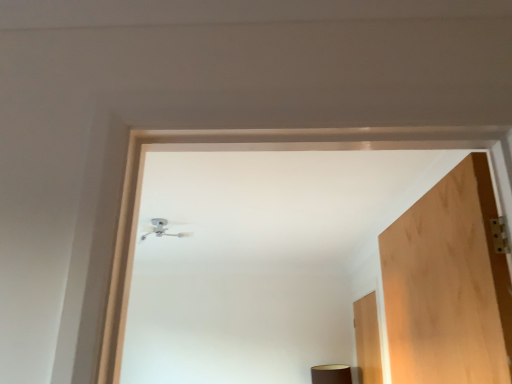
Question: Do you think wooden door at right is within white metallic ceiling light at upper center, or outside of it?

Choices:
 (A) outside
 (B) inside

Answer: (A)

Question: Considering the positions of wooden door at right and white metallic ceiling light at upper center in the image, is wooden door at right wider or thinner than white metallic ceiling light at upper center?

Choices:
 (A) wide
 (B) thin

Answer: (B)

Question: Based on their sizes in the image, would you say wooden door at right is bigger or smaller than white metallic ceiling light at upper center?

Choices:
 (A) big
 (B) small

Answer: (A)

Question: Based on their sizes in the image, would you say white metallic ceiling light at upper center is bigger or smaller than wooden door at right?

Choices:
 (A) small
 (B) big

Answer: (A)

Question: Is white metallic ceiling light at upper center inside the boundaries of wooden door at right, or outside?

Choices:
 (A) outside
 (B) inside

Answer: (A)

Question: Considering their positions, is white metallic ceiling light at upper center located in front of or behind wooden door at right?

Choices:
 (A) front
 (B) behind

Answer: (A)

Question: From a real-world perspective, is white metallic ceiling light at upper center above or below wooden door at right?

Choices:
 (A) above
 (B) below

Answer: (A)